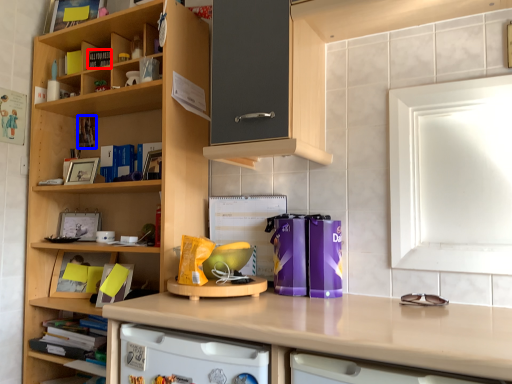
Question: Among these objects, which one is nearest to the camera, book (highlighted by a red box) or book (highlighted by a blue box)?

Choices:
 (A) book
 (B) book

Answer: (A)